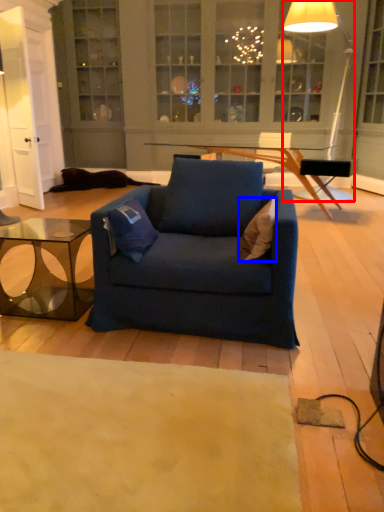
Question: Which of the following is the farthest to the observer, lamp (highlighted by a red box) or pillow (highlighted by a blue box)?

Choices:
 (A) lamp
 (B) pillow

Answer: (A)